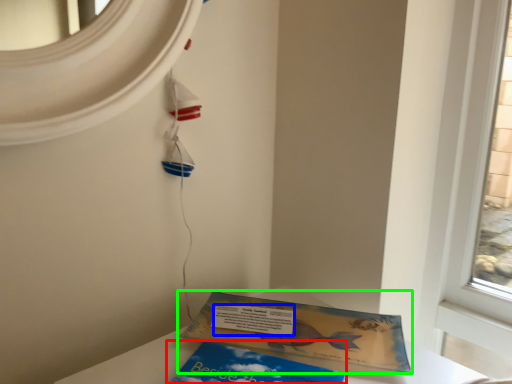
Question: Which object is positioned closest to book (highlighted by a red box)? Select from writing (highlighted by a blue box) and book (highlighted by a green box).

Choices:
 (A) writing
 (B) book

Answer: (B)